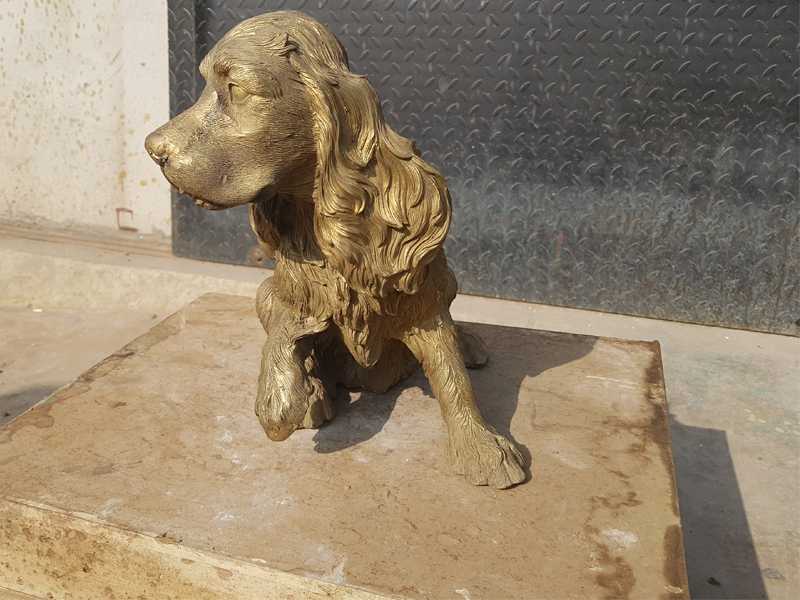
Where is `statue`? The height and width of the screenshot is (600, 800). statue is located at coordinates (293, 143).